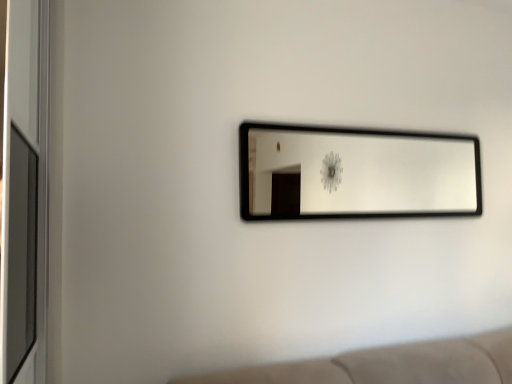
Locate an element on the screen. The image size is (512, 384). black glass mirror at upper center is located at coordinates (356, 173).

The image size is (512, 384). What do you see at coordinates (356, 173) in the screenshot?
I see `black glass mirror at upper center` at bounding box center [356, 173].

In order to face black glass mirror at upper center, should I rotate leftwards or rightwards?

You should rotate right by 15.389 degrees.

At what (x,y) coordinates should I click in order to perform the action: click on black glass mirror at upper center. Please return your answer as a coordinate pair (x, y). Looking at the image, I should click on (356, 173).